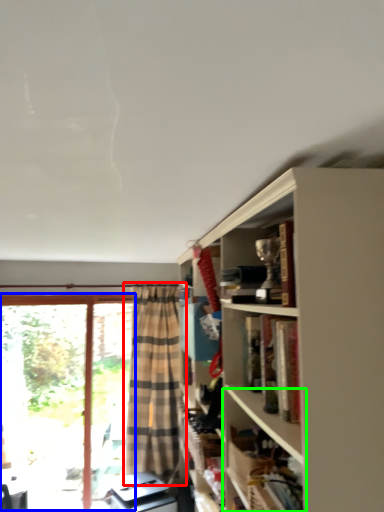
Question: Considering the real-world distances, which object is farthest from curtain (highlighted by a red box)? bay window (highlighted by a blue box) or shelf (highlighted by a green box)?

Choices:
 (A) bay window
 (B) shelf

Answer: (B)